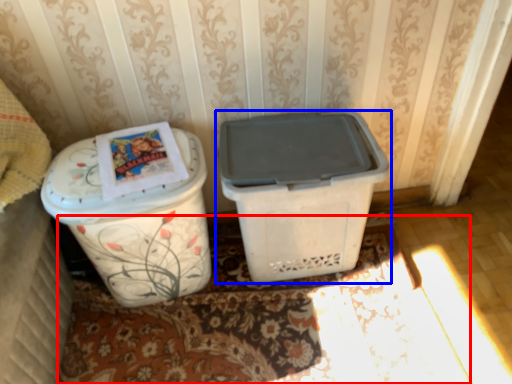
Question: Which of the following is the farthest to the observer, doormat (highlighted by a red box) or waste container (highlighted by a blue box)?

Choices:
 (A) doormat
 (B) waste container

Answer: (A)